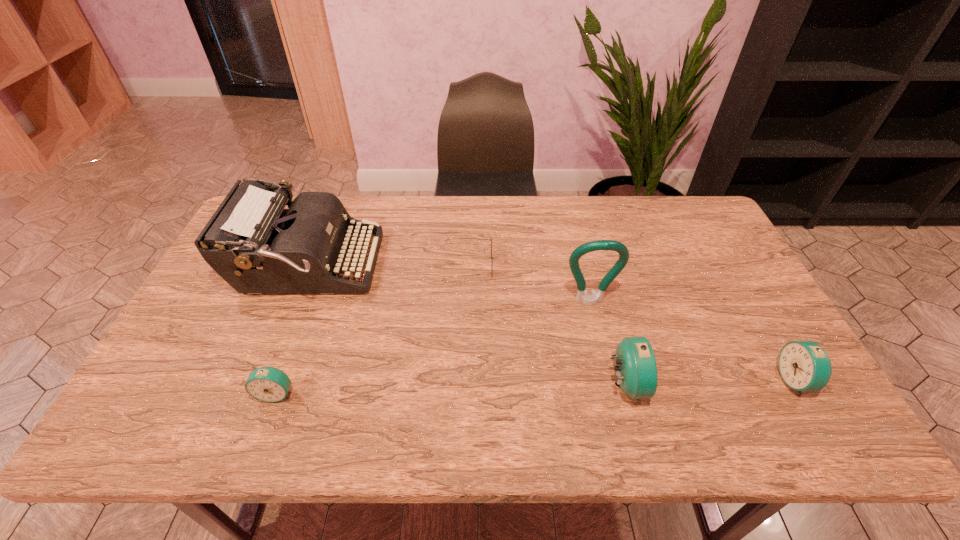
Where is `location for an additional alarm_clock to make spacing equal`? location for an additional alarm_clock to make spacing equal is located at coordinates (452, 389).